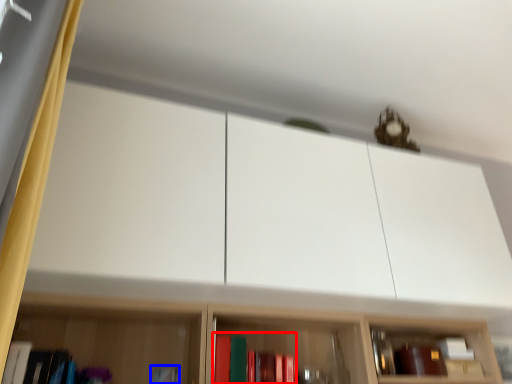
Question: Among these objects, which one is nearest to the camera, book (highlighted by a red box) or book (highlighted by a blue box)?

Choices:
 (A) book
 (B) book

Answer: (A)